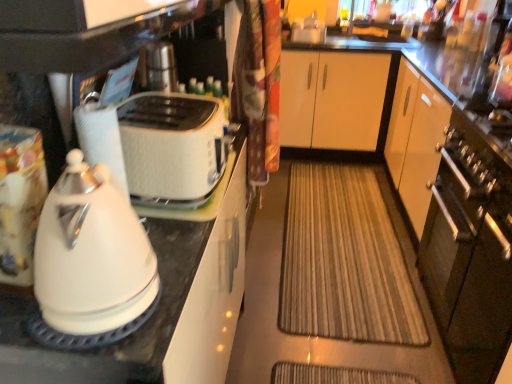
Question: Is white glossy kettle at left thinner than white glossy paper towel at left?

Choices:
 (A) no
 (B) yes

Answer: (A)

Question: Is white glossy kettle at left far from white glossy paper towel at left?

Choices:
 (A) yes
 (B) no

Answer: (B)

Question: Is white glossy paper towel at left inside white glossy kettle at left?

Choices:
 (A) no
 (B) yes

Answer: (A)

Question: From a real-world perspective, is white glossy kettle at left physically above white glossy paper towel at left?

Choices:
 (A) yes
 (B) no

Answer: (A)

Question: From the image's perspective, would you say white glossy kettle at left is positioned over white glossy paper towel at left?

Choices:
 (A) no
 (B) yes

Answer: (A)

Question: Can you confirm if white glossy kettle at left is shorter than white glossy paper towel at left?

Choices:
 (A) yes
 (B) no

Answer: (B)

Question: Considering the relative sizes of brown textured mat at center and satin silver oven at right in the image provided, is brown textured mat at center thinner than satin silver oven at right?

Choices:
 (A) no
 (B) yes

Answer: (A)

Question: Is brown textured mat at center not within satin silver oven at right?

Choices:
 (A) no
 (B) yes

Answer: (B)

Question: From the image's perspective, is brown textured mat at center located beneath satin silver oven at right?

Choices:
 (A) no
 (B) yes

Answer: (A)

Question: Is brown textured mat at center aimed at satin silver oven at right?

Choices:
 (A) yes
 (B) no

Answer: (B)

Question: Is the position of brown textured mat at center less distant than that of satin silver oven at right?

Choices:
 (A) yes
 (B) no

Answer: (B)

Question: From a real-world perspective, is brown textured mat at center positioned under satin silver oven at right based on gravity?

Choices:
 (A) yes
 (B) no

Answer: (A)

Question: Is satin silver oven at right taller than white glossy paper towel at left?

Choices:
 (A) yes
 (B) no

Answer: (A)